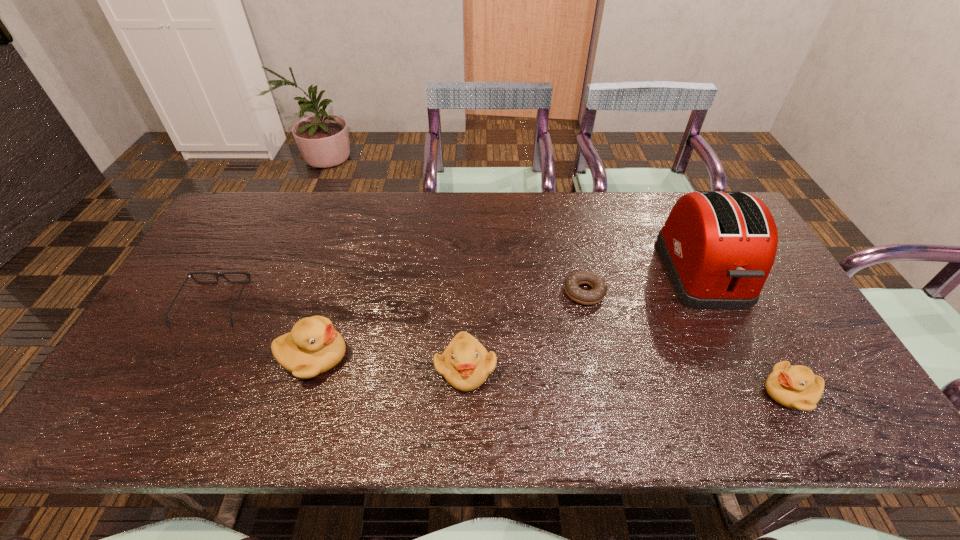
Identify the location of the second object from left to right. This screenshot has height=540, width=960. (314, 346).

Identify the location of the second tallest duckling. (465, 364).

Image resolution: width=960 pixels, height=540 pixels. In order to click on the fourth shortest object in this screenshot , I will do `click(465, 364)`.

This screenshot has width=960, height=540. Find the location of `the rightmost duckling`. the rightmost duckling is located at coordinates (796, 387).

Image resolution: width=960 pixels, height=540 pixels. Identify the location of the shortest duckling. (796, 387).

The height and width of the screenshot is (540, 960). In order to click on spectacles in this screenshot , I will do (x=190, y=275).

Identify the location of the tallest object. [x=718, y=247].

The height and width of the screenshot is (540, 960). What are the coordinates of `doughnut` in the screenshot? It's located at (599, 288).

The height and width of the screenshot is (540, 960). In order to click on free space located at the beak of the leftmost duckling in this screenshot , I will do `click(379, 357)`.

You are a GUI agent. You are given a task and a screenshot of the screen. Output one action in this format:
    pyautogui.click(x=<x>, y=<y>)
    Task: Click on the free region located 0.060m at the beak of the shortest duckling
    This screenshot has width=960, height=540.
    Given the screenshot: What is the action you would take?
    pyautogui.click(x=738, y=393)